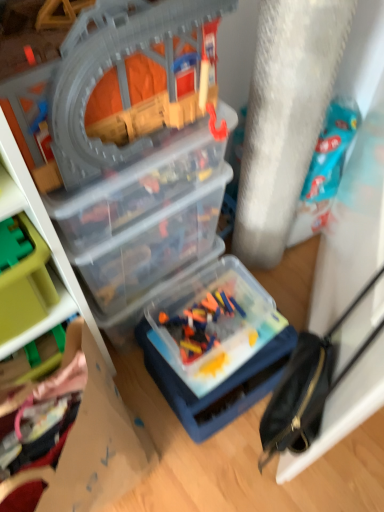
The height and width of the screenshot is (512, 384). What do you see at coordinates (66, 368) in the screenshot?
I see `plush pink blanket at lower left, the 1th toy ordered from the bottom` at bounding box center [66, 368].

The width and height of the screenshot is (384, 512). In order to click on black leather bag at right in this screenshot , I will do `click(309, 386)`.

What is the approximate width of black leather bag at right?

black leather bag at right is 3.17 inches in width.

Where is `transparent plastic train set at upper left, which is the fifth toy from bottom to top`? transparent plastic train set at upper left, which is the fifth toy from bottom to top is located at coordinates (116, 87).

What is the approximate height of green plastic toy at left, acting as the second toy starting from the top?

It is 3.17 centimeters.

Find the location of a particular element. This screenshot has width=384, height=512. plush pink blanket at lower left, the 1th toy ordered from the bottom is located at coordinates (66, 368).

Are transparent plastic train set at upper left, which is the fifth toy from bottom to top, and translucent plastic container at center, the 1th box in the back-to-front sequence, far apart?

They are positioned close to each other.

From the picture: Does transparent plastic train set at upper left, which is the fifth toy from bottom to top, appear on the left side of translucent plastic container at center, which is the 2th box from front to back?

No.

Can you confirm if transparent plastic train set at upper left, which is the fifth toy from bottom to top, is taller than translucent plastic container at center, the 1th box in the back-to-front sequence?

Correct, transparent plastic train set at upper left, which is the fifth toy from bottom to top, is much taller as translucent plastic container at center, the 1th box in the back-to-front sequence.

How many degrees apart are the facing directions of transparent plastic train set at upper left, which is the fifth toy from bottom to top, and translucent plastic container at center, the 1th box in the back-to-front sequence?

transparent plastic train set at upper left, which is the fifth toy from bottom to top, and translucent plastic container at center, the 1th box in the back-to-front sequence, are facing 0.00064 degrees away from each other.

Would you say transparent plastic train set at upper left, which is the fifth toy from bottom to top, is to the left or to the right of cardboard at lower left in the picture?

Clearly, transparent plastic train set at upper left, which is the fifth toy from bottom to top, is on the right of cardboard at lower left in the image.

Does transparent plastic train set at upper left, which is the fifth toy from bottom to top, come in front of cardboard at lower left?

Yes, transparent plastic train set at upper left, which is the fifth toy from bottom to top, is closer to the viewer.

Is transparent plastic train set at upper left, which is the fifth toy from bottom to top, oriented away from cardboard at lower left?

That's not correct — transparent plastic train set at upper left, which is the fifth toy from bottom to top, is not looking away from cardboard at lower left.

Where is `cardboard box on the left of the black leather bag at right`? cardboard box on the left of the black leather bag at right is located at coordinates (97, 439).

Is black leather bag at right oriented towards cardboard at lower left?

Yes, black leather bag at right is turned towards cardboard at lower left.

Is black leather bag at right bigger than cardboard at lower left?

Actually, black leather bag at right might be smaller than cardboard at lower left.

Which object is further away from the camera, cardboard at lower left or green plastic toy at left, acting as the second toy starting from the top?

green plastic toy at left, acting as the second toy starting from the top, is behind.

Considering the positions of objects cardboard at lower left and green plastic toy at left, marked as the fourth toy in a bottom-to-top arrangement, in the image provided, who is more to the left, cardboard at lower left or green plastic toy at left, marked as the fourth toy in a bottom-to-top arrangement,?

green plastic toy at left, marked as the fourth toy in a bottom-to-top arrangement.

From the cardboard at lower left, count 2nd toys backward and point to it. Please provide its 2D coordinates.

[(12, 244)]

Which of these two, cardboard at lower left or green plastic toy at left, acting as the second toy starting from the top, stands shorter?

green plastic toy at left, acting as the second toy starting from the top.

Can you confirm if translucent plastic container at center, the 2th toy from the bottom, is shorter than black leather bag at right?

Indeed, translucent plastic container at center, the 2th toy from the bottom, has a lesser height compared to black leather bag at right.

From a real-world perspective, is translucent plastic container at center, placed as the fourth toy when sorted from top to bottom, physically located above or below black leather bag at right?

In terms of real-world spatial position, translucent plastic container at center, placed as the fourth toy when sorted from top to bottom, is below black leather bag at right.

Does translucent plastic container at center, placed as the fourth toy when sorted from top to bottom, appear on the left side of black leather bag at right?

Correct, you'll find translucent plastic container at center, placed as the fourth toy when sorted from top to bottom, to the left of black leather bag at right.

Does translucent plastic container at center, placed as the fourth toy when sorted from top to bottom, have a smaller size compared to black leather bag at right?

No, translucent plastic container at center, placed as the fourth toy when sorted from top to bottom, is not smaller than black leather bag at right.

Which object is further away from the camera, cardboard at lower left or translucent plastic container at center, the 1th box in the back-to-front sequence?

translucent plastic container at center, the 1th box in the back-to-front sequence, is further away from the camera.

Does cardboard at lower left have a greater height compared to translucent plastic container at center, the 1th box in the back-to-front sequence?

Correct, cardboard at lower left is much taller as translucent plastic container at center, the 1th box in the back-to-front sequence.

Is point (98, 359) behind point (113, 263)?

No.

Are cardboard at lower left and translucent plastic container at center, the 1th box in the back-to-front sequence, located far from each other?

No, cardboard at lower left is not far away from translucent plastic container at center, the 1th box in the back-to-front sequence.

Looking at the image, does black leather bag at right seem bigger or smaller compared to green plastic toy at left, acting as the 3th toy starting from the bottom?

Clearly, black leather bag at right is larger in size than green plastic toy at left, acting as the 3th toy starting from the bottom.

Is green plastic toy at left, which is counted as the third toy, starting from the top, surrounded by black leather bag at right?

Actually, green plastic toy at left, which is counted as the third toy, starting from the top, is outside black leather bag at right.

Is black leather bag at right further to camera compared to green plastic toy at left, which is counted as the third toy, starting from the top?

No, black leather bag at right is closer to the camera.

Is black leather bag at right looking in the opposite direction of green plastic toy at left, acting as the 3th toy starting from the bottom?

No.

Where is `the 2nd box to the left when counting from the transparent plastic train set at upper left, which is the fifth toy from bottom to top`? Image resolution: width=384 pixels, height=512 pixels. the 2nd box to the left when counting from the transparent plastic train set at upper left, which is the fifth toy from bottom to top is located at coordinates (152, 250).

This screenshot has height=512, width=384. In order to click on cardboard box behind the transparent plastic train set at upper left, the first toy from the top in this screenshot , I will do `click(97, 439)`.

From the image, which object appears to be farther from green plastic toy at left, marked as the fourth toy in a bottom-to-top arrangement, transparent plastic train set at upper left, the first toy from the top, or translucent plastic container at center, placed as the fourth toy when sorted from top to bottom?

translucent plastic container at center, placed as the fourth toy when sorted from top to bottom.

Estimate the real-world distances between objects in this image. Which object is closer to cardboard at lower left, green plastic toy at left, acting as the 3th toy starting from the bottom, or green plastic toy at left, acting as the second toy starting from the top?

green plastic toy at left, acting as the 3th toy starting from the bottom, is positioned closer to the anchor cardboard at lower left.

Looking at the image, which one is located further to cardboard at lower left, green plastic toy at left, marked as the fourth toy in a bottom-to-top arrangement, or transparent plastic train set at upper left, which is the fifth toy from bottom to top?

transparent plastic train set at upper left, which is the fifth toy from bottom to top, lies further to cardboard at lower left than the other object.

Based on the photo, looking at the image, which one is located further to transparent plastic toy box at upper left, the 1th box when ordered from front to back, green plastic toy at left, marked as the fourth toy in a bottom-to-top arrangement, or transparent plastic train set at upper left, the first toy from the top?

green plastic toy at left, marked as the fourth toy in a bottom-to-top arrangement, is further to transparent plastic toy box at upper left, the 1th box when ordered from front to back.

From the image, which object appears to be farther from black leather bag at right, transparent plastic train set at upper left, which is the fifth toy from bottom to top, or green plastic toy at left, which is counted as the third toy, starting from the top?

green plastic toy at left, which is counted as the third toy, starting from the top, is positioned further to the anchor black leather bag at right.

From the image, which object appears to be farther from green plastic toy at left, which is counted as the third toy, starting from the top, translucent plastic container at center, the 1th box in the back-to-front sequence, or cardboard at lower left?

cardboard at lower left lies further to green plastic toy at left, which is counted as the third toy, starting from the top, than the other object.

From the image, which object appears to be nearer to translucent plastic container at center, placed as the fourth toy when sorted from top to bottom, plush pink blanket at lower left, which appears as the fifth toy when viewed from the top, or translucent plastic container at center, the 1th box in the back-to-front sequence?

translucent plastic container at center, the 1th box in the back-to-front sequence.

From the image, which object appears to be nearer to green plastic toy at left, acting as the 3th toy starting from the bottom, plush pink blanket at lower left, which appears as the fifth toy when viewed from the top, or translucent plastic container at center, which is the 2th box from front to back?

plush pink blanket at lower left, which appears as the fifth toy when viewed from the top.

At what (x,y) coordinates should I click in order to perform the action: click on cardboard box between black leather bag at right and translucent plastic container at center, placed as the fourth toy when sorted from top to bottom, along the z-axis. Please return your answer as a coordinate pair (x, y). Looking at the image, I should click on (97, 439).

Where is `cardboard box located between plush pink blanket at lower left, the 1th toy ordered from the bottom, and black leather bag at right in the left-right direction`? cardboard box located between plush pink blanket at lower left, the 1th toy ordered from the bottom, and black leather bag at right in the left-right direction is located at coordinates (97, 439).

You are a GUI agent. You are given a task and a screenshot of the screen. Output one action in this format:
    pyautogui.click(x=<x>, y=<y>)
    Task: Click on the box between transparent plastic train set at upper left, which is the fifth toy from bottom to top, and translucent plastic container at center, the 1th box in the back-to-front sequence, from front to back
    This screenshot has width=384, height=512.
    Given the screenshot: What is the action you would take?
    pyautogui.click(x=136, y=188)

The width and height of the screenshot is (384, 512). I want to click on accessory between transparent plastic toy box at upper left, arranged as the second box when viewed from the back, and plush pink blanket at lower left, the 1th toy ordered from the bottom, from top to bottom, so click(309, 386).